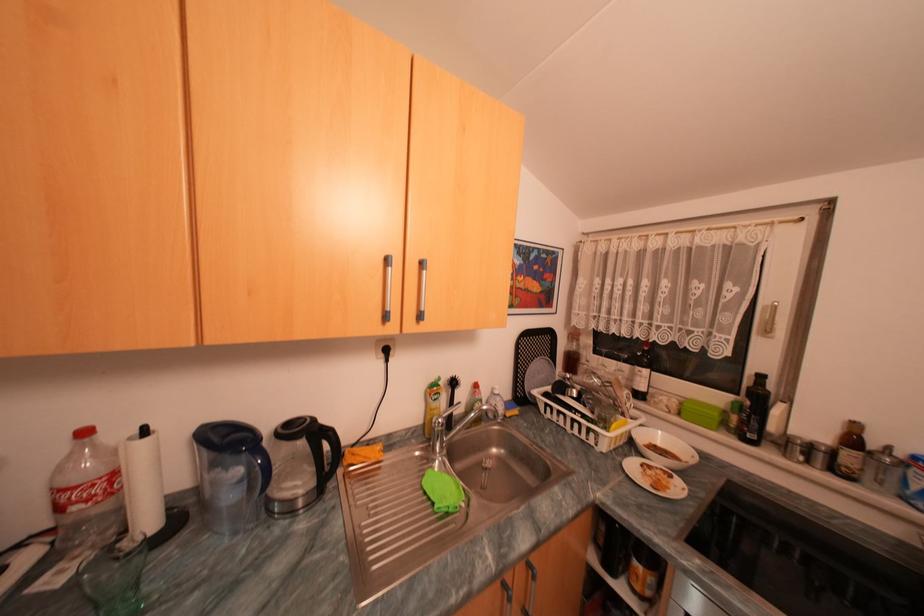
Find where to pour the blue pitcher handle. Please return your answer as a coordinate pair (x, y).

(261, 466)